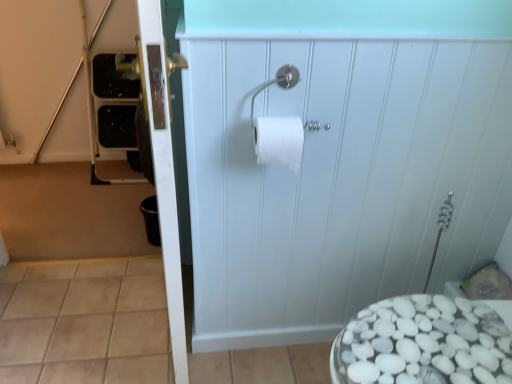
Question: Considering the relative sizes of white glossy door at left, acting as the first screen door starting from the left, and white matte toilet paper at center in the image provided, is white glossy door at left, acting as the first screen door starting from the left, taller than white matte toilet paper at center?

Choices:
 (A) no
 (B) yes

Answer: (B)

Question: From a real-world perspective, is white glossy door at left, acting as the first screen door starting from the left, physically above white matte toilet paper at center?

Choices:
 (A) no
 (B) yes

Answer: (A)

Question: From the image's perspective, does white glossy door at left, acting as the first screen door starting from the left, appear higher than white matte toilet paper at center?

Choices:
 (A) yes
 (B) no

Answer: (B)

Question: Can you confirm if white glossy door at left, the 2th screen door in the right-to-left sequence, is smaller than white matte toilet paper at center?

Choices:
 (A) yes
 (B) no

Answer: (B)

Question: Is white glossy door at left, acting as the first screen door starting from the left, facing towards white matte toilet paper at center?

Choices:
 (A) yes
 (B) no

Answer: (A)

Question: From a real-world perspective, does white glossy door at left, the 2th screen door in the right-to-left sequence, sit lower than white matte toilet paper at center?

Choices:
 (A) yes
 (B) no

Answer: (A)

Question: From the image's perspective, is silver metallic toilet paper holder at upper center located beneath white matte toilet paper at center?

Choices:
 (A) no
 (B) yes

Answer: (A)

Question: From a real-world perspective, is silver metallic toilet paper holder at upper center positioned under white matte toilet paper at center based on gravity?

Choices:
 (A) yes
 (B) no

Answer: (B)

Question: Is silver metallic toilet paper holder at upper center at the left side of white matte toilet paper at center?

Choices:
 (A) no
 (B) yes

Answer: (A)

Question: Can you confirm if silver metallic toilet paper holder at upper center is taller than white matte toilet paper at center?

Choices:
 (A) yes
 (B) no

Answer: (B)

Question: Is silver metallic toilet paper holder at upper center not near white matte toilet paper at center?

Choices:
 (A) no
 (B) yes

Answer: (A)

Question: Can we say silver metallic toilet paper holder at upper center lies outside white matte toilet paper at center?

Choices:
 (A) no
 (B) yes

Answer: (B)

Question: Considering the relative positions of white matte cabinet at center, which is counted as the first screen door, starting from the right, and silver metallic toilet paper holder at upper center in the image provided, is white matte cabinet at center, which is counted as the first screen door, starting from the right, to the right of silver metallic toilet paper holder at upper center from the viewer's perspective?

Choices:
 (A) yes
 (B) no

Answer: (A)